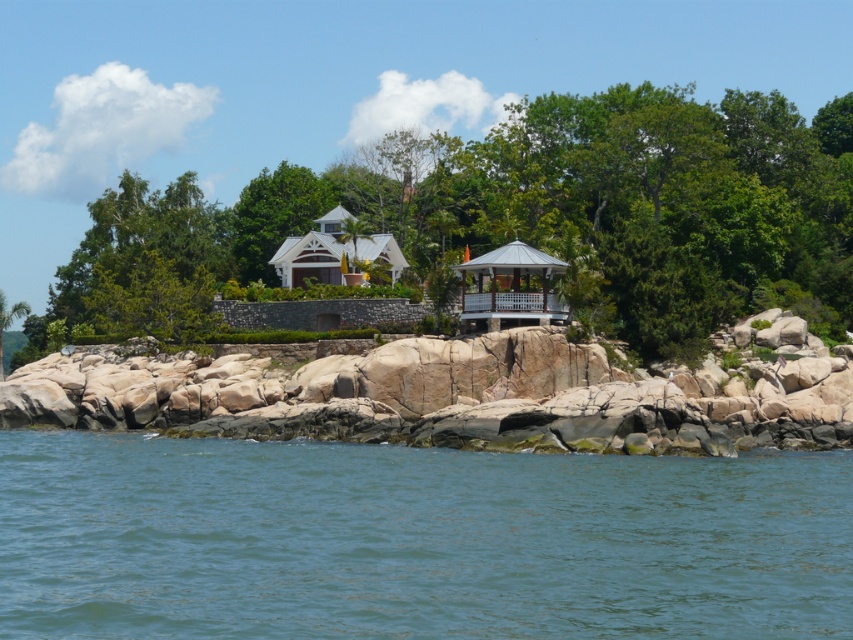
You are standing at the point marked as point (415,540) in the coastal scene. What can you see directly in front of you?

At point (415,540) lies blue water at lower center, so you can see blue water at lower center directly in front of you.